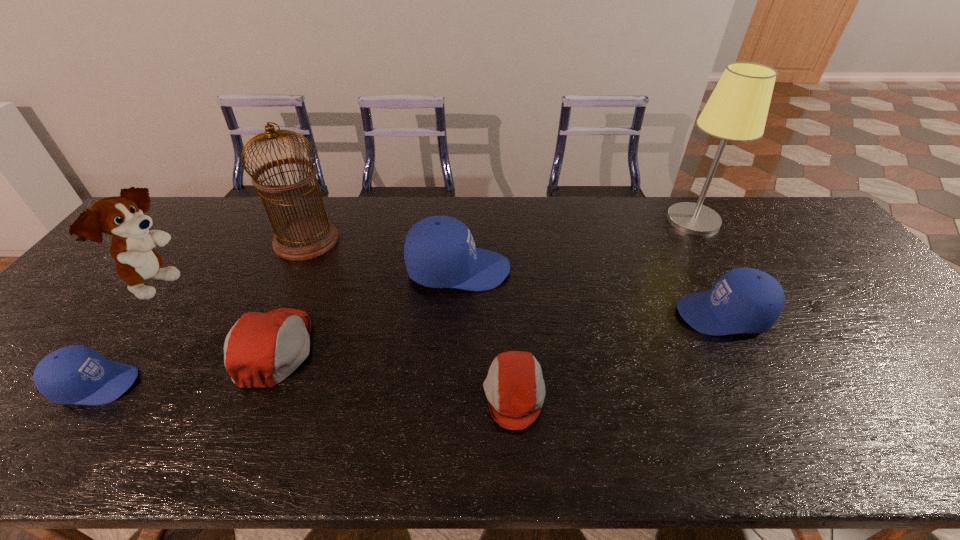
The image size is (960, 540). Identify the location of the leftmost cap. (76, 374).

Where is `the smallest blue cap`? This screenshot has width=960, height=540. the smallest blue cap is located at coordinates (76, 374).

Image resolution: width=960 pixels, height=540 pixels. In order to click on the shortest object in this screenshot , I will do `click(515, 389)`.

The width and height of the screenshot is (960, 540). Identify the location of the right red cap. (515, 389).

The width and height of the screenshot is (960, 540). I want to click on vacant space located 0.360m on the left of the table lamp, so click(559, 220).

This screenshot has height=540, width=960. Identify the location of free spot located 0.310m on the front-facing side of the birdcage. (437, 240).

Where is `vacant position located 0.080m on the face of the brown puppy`? The height and width of the screenshot is (540, 960). vacant position located 0.080m on the face of the brown puppy is located at coordinates (219, 287).

Identify the location of vacant point located 0.320m on the front-facing side of the second blue cap from left to right. (619, 270).

Locate an element on the screen. This screenshot has width=960, height=540. vacant region located 0.100m on the front-facing side of the second biggest blue cap is located at coordinates (639, 314).

You are a GUI agent. You are given a task and a screenshot of the screen. Output one action in this format:
    pyautogui.click(x=<x>, y=<y>)
    Task: Click on the vacant space located 0.240m on the front-facing side of the second biggest blue cap
    This screenshot has height=540, width=960.
    Given the screenshot: What is the action you would take?
    pyautogui.click(x=586, y=314)